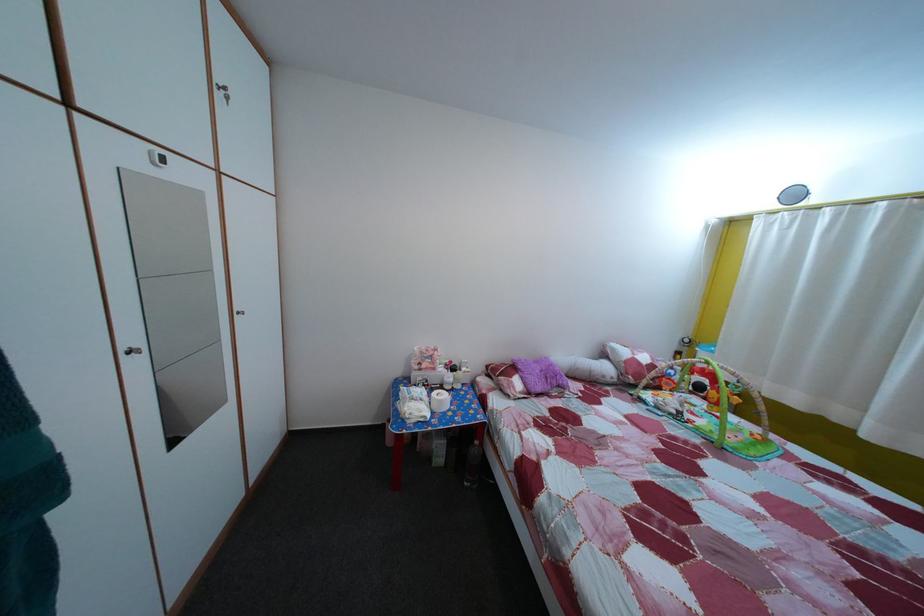
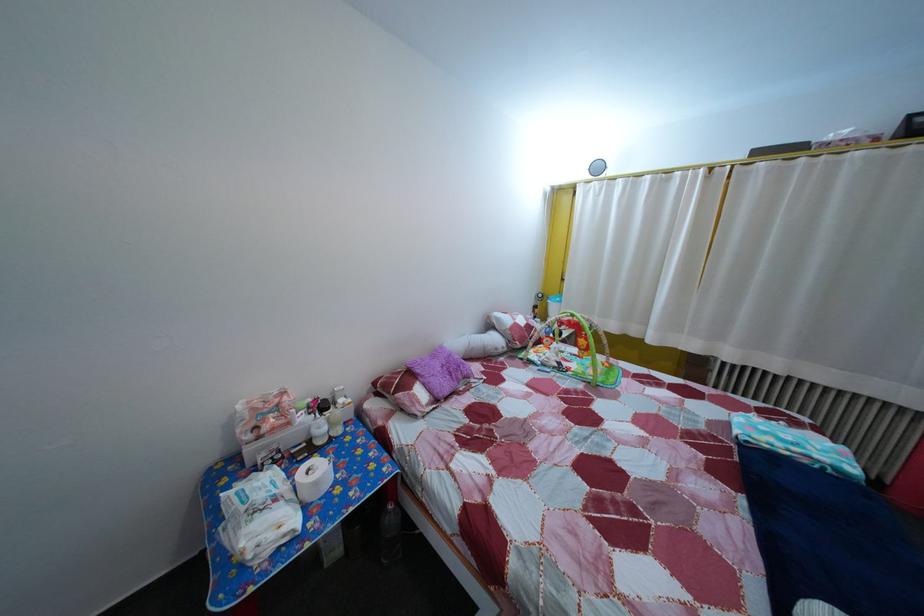
The point at (451, 377) is marked in the first image. Where is the corresponding point in the second image?

(311, 427)